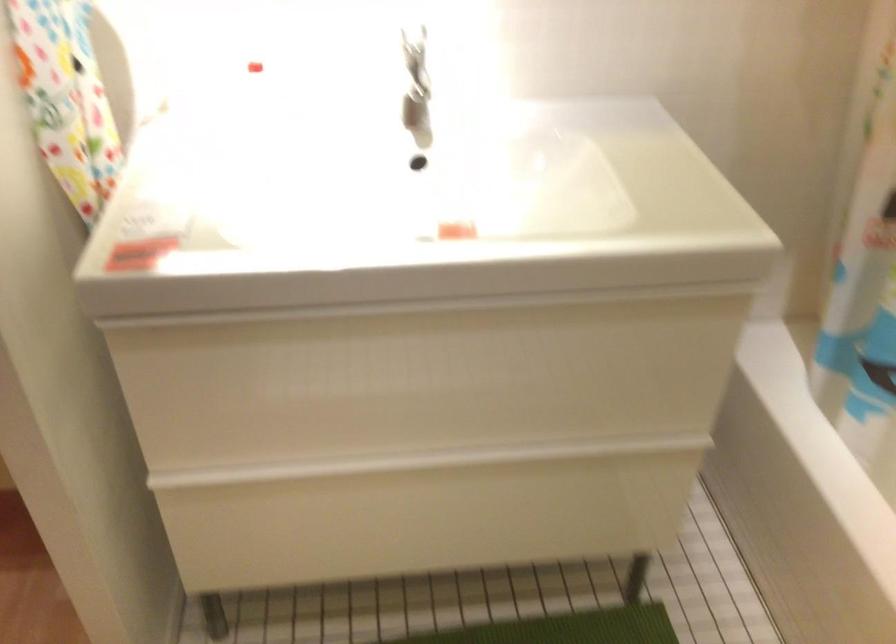
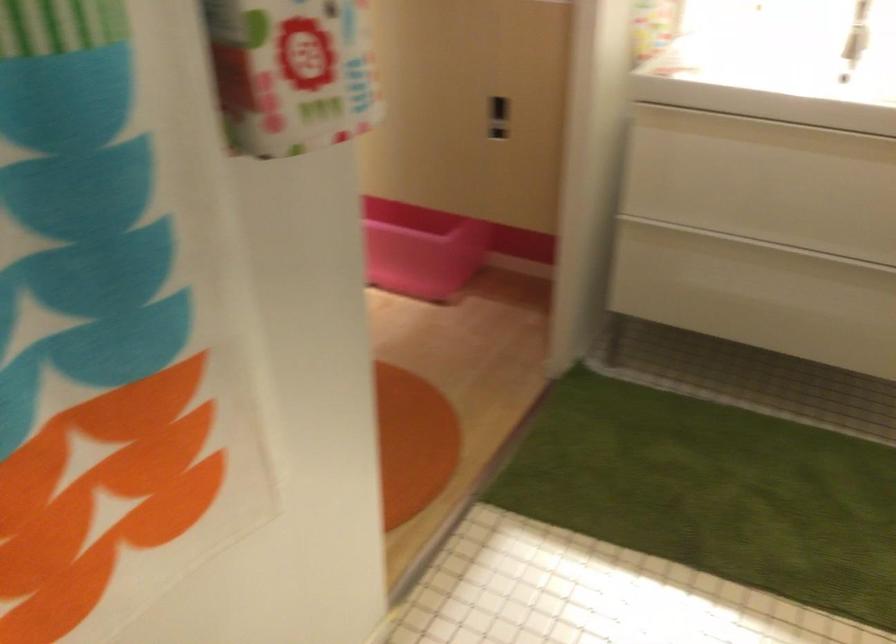
In the second image, find the point that corresponds to (345,333) in the first image.

(764, 131)